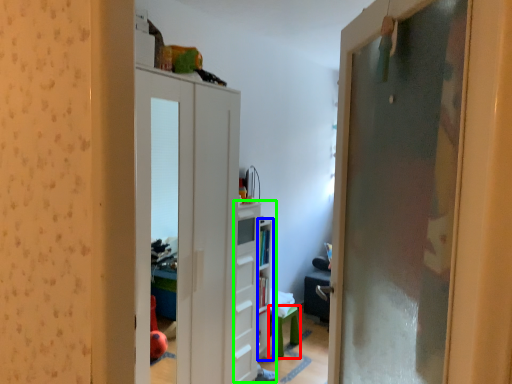
Question: Considering the real-world distances, which object is closest to furniture (highlighted by a red box)? shelf (highlighted by a blue box) or dresser (highlighted by a green box).

Choices:
 (A) shelf
 (B) dresser

Answer: (A)